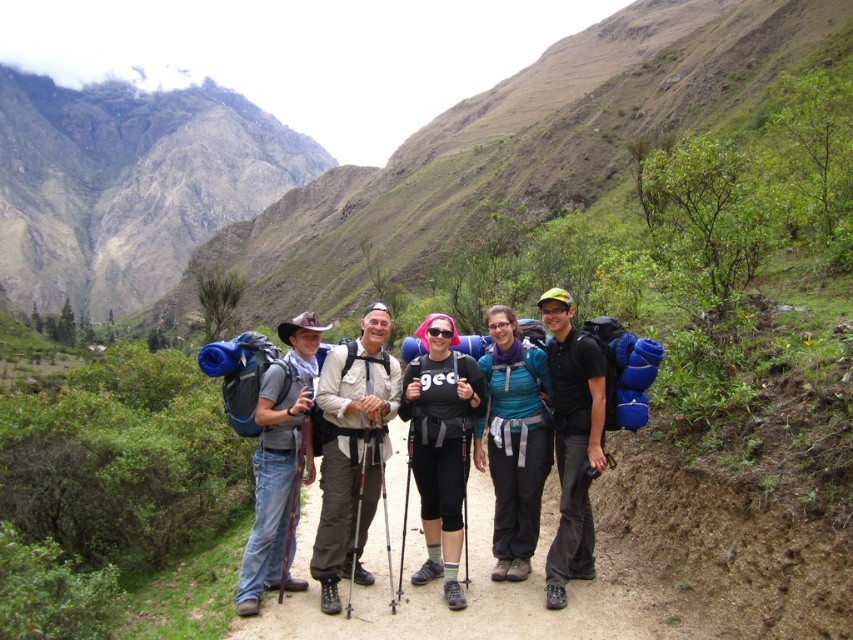
Is light beige fabric shirt at center positioned at the back of blue fabric backpack at left?

Yes, light beige fabric shirt at center is behind blue fabric backpack at left.

The image size is (853, 640). Find the location of `light beige fabric shirt at center`. light beige fabric shirt at center is located at coordinates (352, 451).

Is the position of light beige fabric shirt at center more distant than that of teal fabric backpack at center?

No, it is in front of teal fabric backpack at center.

Can you confirm if light beige fabric shirt at center is thinner than teal fabric backpack at center?

No, light beige fabric shirt at center is not thinner than teal fabric backpack at center.

Describe the element at coordinates (352, 451) in the screenshot. I see `light beige fabric shirt at center` at that location.

Locate an element on the screen. The image size is (853, 640). light beige fabric shirt at center is located at coordinates (x=352, y=451).

Does black matte backpack at center appear under black matte backpack at right?

Indeed, black matte backpack at center is positioned under black matte backpack at right.

This screenshot has height=640, width=853. What do you see at coordinates (440, 445) in the screenshot?
I see `black matte backpack at center` at bounding box center [440, 445].

Does point (422, 497) come in front of point (569, 499)?

No, (422, 497) is behind (569, 499).

This screenshot has height=640, width=853. I want to click on black matte backpack at center, so click(x=440, y=445).